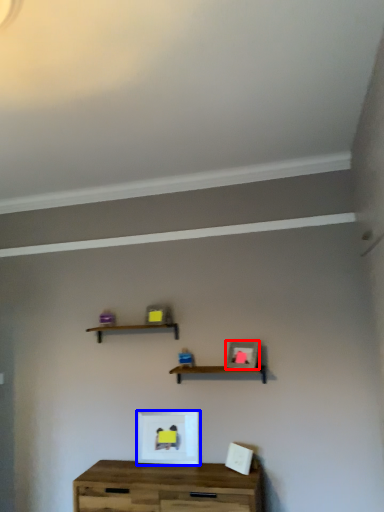
Question: Which point is further to the camera, picture frame (highlighted by a red box) or picture frame (highlighted by a blue box)?

Choices:
 (A) picture frame
 (B) picture frame

Answer: (B)